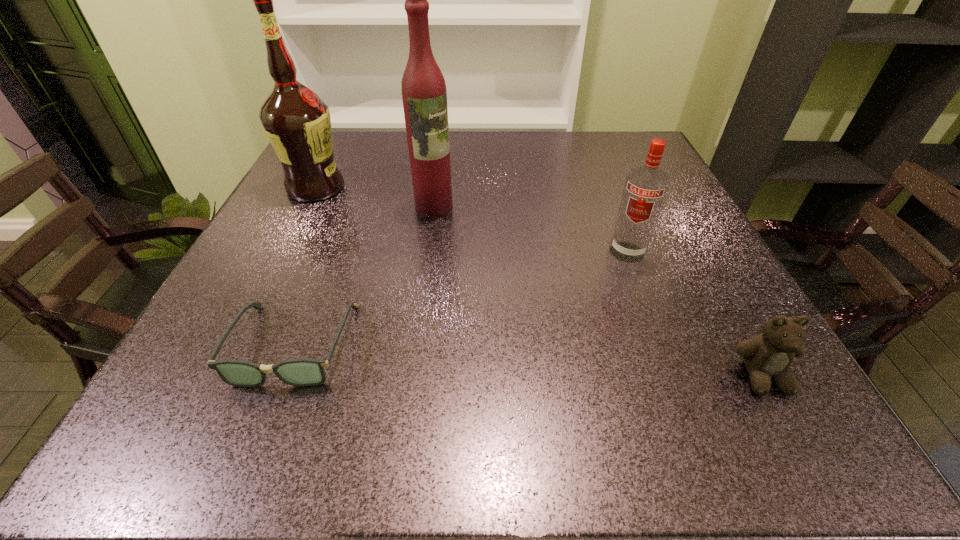
You are a GUI agent. You are given a task and a screenshot of the screen. Output one action in this format:
    pyautogui.click(x=<x>, y=<y>)
    Task: Click on the spectacles
    
    Given the screenshot: What is the action you would take?
    pyautogui.click(x=302, y=371)

Locate an element on the screen. Image resolution: width=960 pixels, height=540 pixels. the fourth tallest object is located at coordinates (767, 356).

You are a GUI agent. You are given a task and a screenshot of the screen. Output one action in this format:
    pyautogui.click(x=<x>, y=<y>)
    Task: Click on the rightmost object
    The image size is (960, 540).
    Given the screenshot: What is the action you would take?
    pyautogui.click(x=767, y=356)

Find the location of `alcohol`. alcohol is located at coordinates (297, 122).

Locate an element on the screen. This screenshot has width=960, height=540. vodka is located at coordinates (645, 189).

The image size is (960, 540). I want to click on the third shortest object, so click(645, 189).

Locate an element on the screen. This screenshot has height=540, width=960. the third object from right to left is located at coordinates (424, 94).

This screenshot has height=540, width=960. In order to click on blank space located on the label of the alcohol in this screenshot , I will do `click(354, 215)`.

Locate an element on the screen. The image size is (960, 540). vacant region located 0.280m on the label of the alcohol is located at coordinates (408, 254).

What are the coordinates of `blank space located on the label of the alcohol` in the screenshot? It's located at (384, 237).